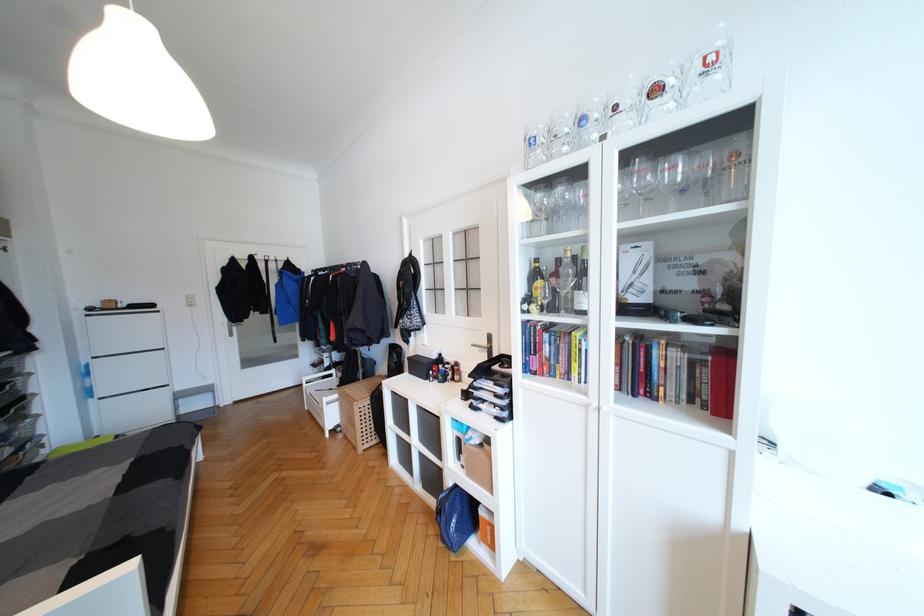
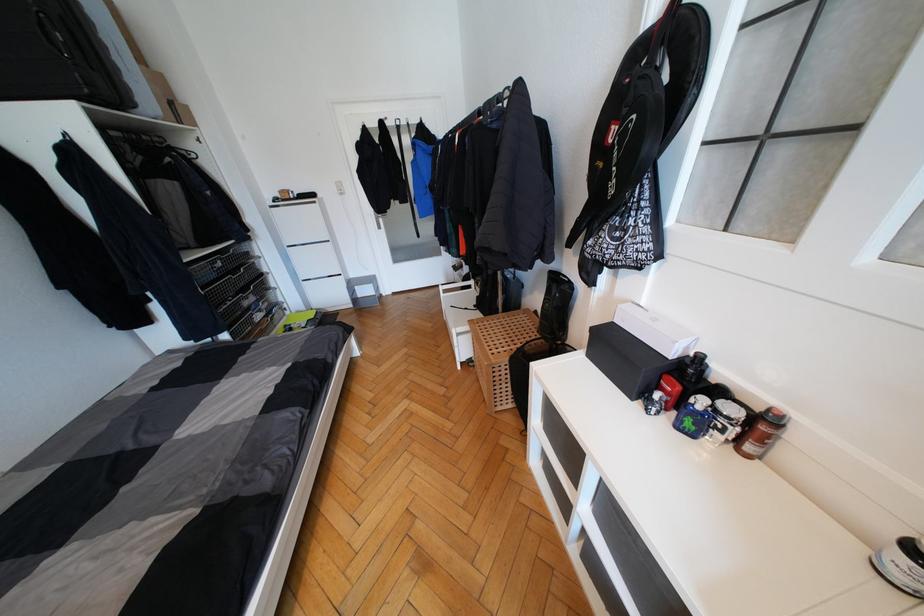
In the second image, find the point that corresponds to (339,405) in the first image.

(472, 338)